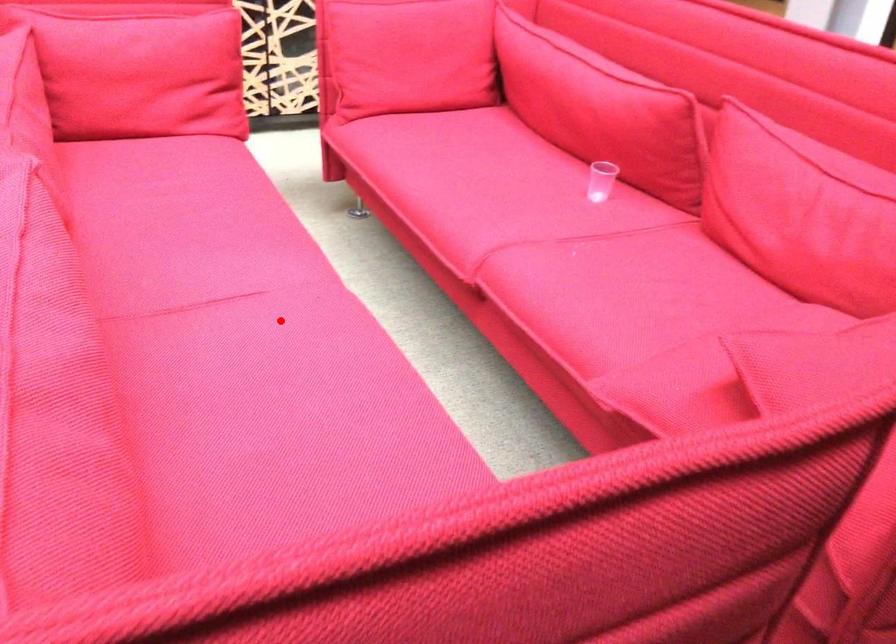
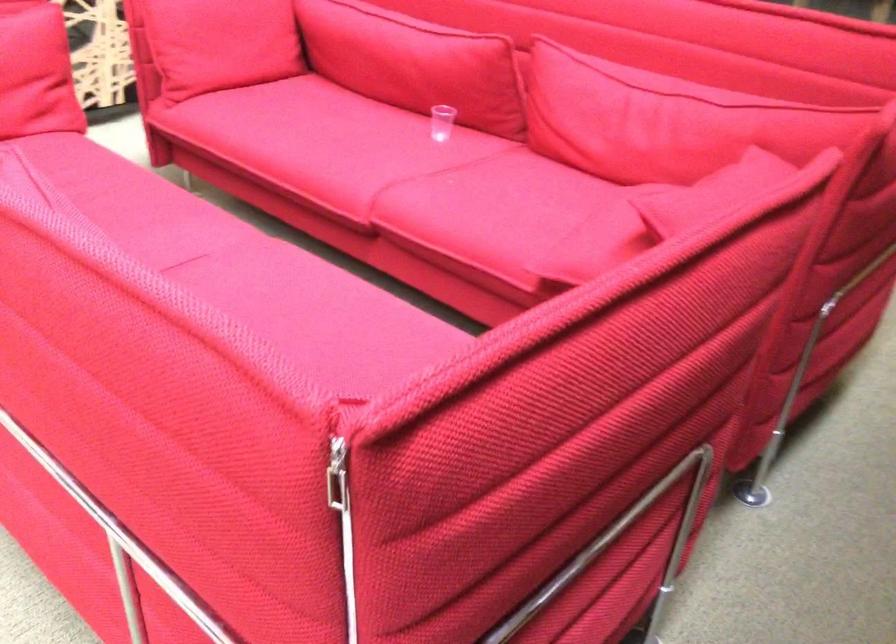
Find the pixel in the second image that matches the highlighted location in the first image.

(244, 270)